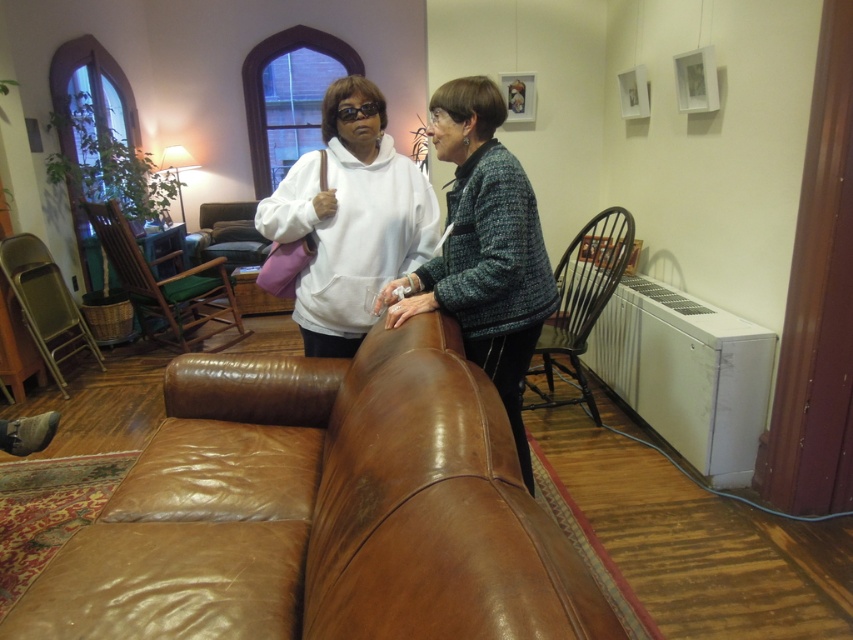
Question: Which object appears farthest from the camera in this image?

Choices:
 (A) metallic gold armchair at left
 (B) brown leather armchair at left

Answer: (B)

Question: Can you confirm if matte brown leather couch at center is positioned to the left of leather armchair at center?

Choices:
 (A) yes
 (B) no

Answer: (B)

Question: Which point is farther from the camera taking this photo?

Choices:
 (A) (61, 358)
 (B) (424, 221)
 (C) (521, 433)
 (D) (317, 547)

Answer: (A)

Question: Which of the following is the closest to the observer?

Choices:
 (A) (245, 250)
 (B) (71, 321)
 (C) (601, 218)

Answer: (C)

Question: Can you confirm if matte brown leather couch at center is positioned above leather armchair at center?

Choices:
 (A) yes
 (B) no

Answer: (B)

Question: Is brown leather couch at center to the right of matte brown leather couch at center from the viewer's perspective?

Choices:
 (A) no
 (B) yes

Answer: (A)